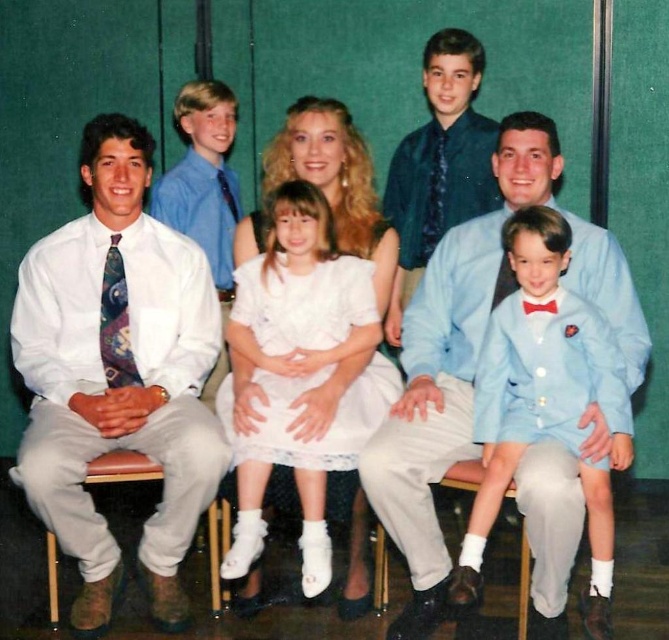
Can you confirm if light blue fabric suit at center is positioned to the right of multicolored silk tie at left?

Yes, light blue fabric suit at center is to the right of multicolored silk tie at left.

Is light blue fabric suit at center wider than multicolored silk tie at left?

Indeed, light blue fabric suit at center has a greater width compared to multicolored silk tie at left.

This screenshot has width=669, height=640. I want to click on light blue fabric suit at center, so click(537, 376).

Which is behind, point (334, 412) or point (470, 548)?

The point (334, 412) is behind.

Based on the photo, how far apart are white lace dress at center and light blue fabric suit at center?

They are 19.87 inches apart.

Find the location of a particular element. The height and width of the screenshot is (640, 669). white lace dress at center is located at coordinates (300, 371).

Is white fabric chair at lower center shorter than brown leather chair at lower right?

Yes.

Does white fabric chair at lower center have a greater width compared to brown leather chair at lower right?

No, white fabric chair at lower center is not wider than brown leather chair at lower right.

At what (x,y) coordinates should I click in order to perform the action: click on white fabric chair at lower center. Please return your answer as a coordinate pair (x, y). Image resolution: width=669 pixels, height=640 pixels. Looking at the image, I should click on click(x=363, y=563).